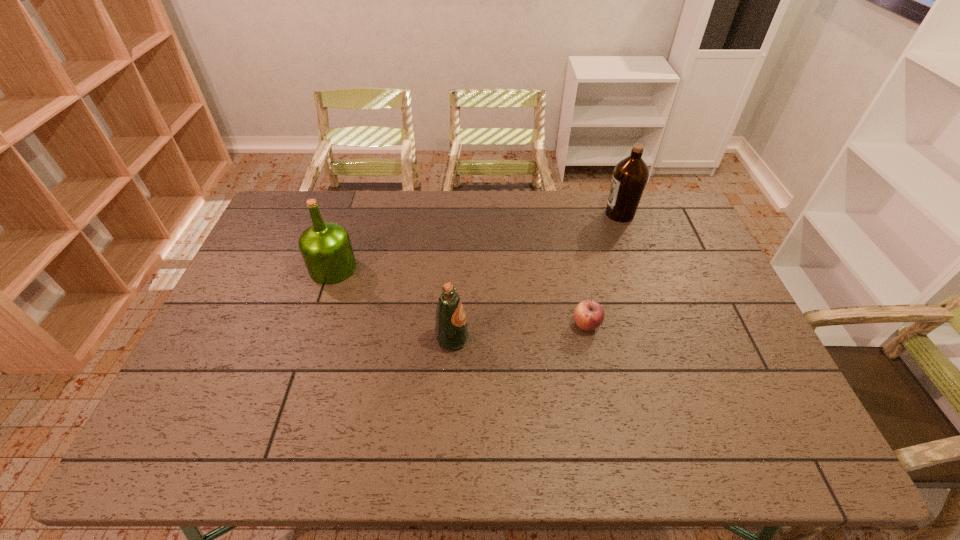
At what (x,y) coordinates should I click in order to perform the action: click on free spot located on the label of the rightmost olive oil. Please return your answer as a coordinate pair (x, y). The image size is (960, 540). Looking at the image, I should click on (563, 214).

You are a GUI agent. You are given a task and a screenshot of the screen. Output one action in this format:
    pyautogui.click(x=<x>, y=<y>)
    Task: Click on the vacant space located on the back of the leftmost olive oil
    This screenshot has height=540, width=960.
    Given the screenshot: What is the action you would take?
    pyautogui.click(x=353, y=205)

You are a GUI agent. You are given a task and a screenshot of the screen. Output one action in this format:
    pyautogui.click(x=<x>, y=<y>)
    Task: Click on the vacant area located on the front-facing side of the second olive oil from right to left
    The width and height of the screenshot is (960, 540).
    Given the screenshot: What is the action you would take?
    pyautogui.click(x=540, y=339)

Where is `free space located on the left of the shortest object`? Image resolution: width=960 pixels, height=540 pixels. free space located on the left of the shortest object is located at coordinates (460, 325).

Locate an element on the screen. The height and width of the screenshot is (540, 960). object present at the far edge is located at coordinates (630, 176).

You are a GUI agent. You are given a task and a screenshot of the screen. Output one action in this format:
    pyautogui.click(x=<x>, y=<y>)
    Task: Click on the free space at the far edge
    This screenshot has width=960, height=540.
    Given the screenshot: What is the action you would take?
    pyautogui.click(x=537, y=219)

In the image, there is a desktop. Where is `vacant area at the near edge`? vacant area at the near edge is located at coordinates (537, 431).

The width and height of the screenshot is (960, 540). In the image, there is a desktop. What are the coordinates of `vacant space at the right edge` in the screenshot? It's located at 735,317.

You are a GUI agent. You are given a task and a screenshot of the screen. Output one action in this format:
    pyautogui.click(x=<x>, y=<y>)
    Task: Click on the vacant space at the far right corner of the desktop
    
    Given the screenshot: What is the action you would take?
    pyautogui.click(x=663, y=199)

Locate an element on the screen. The width and height of the screenshot is (960, 540). vacant region between the shortest object and the leftmost olive oil is located at coordinates (460, 296).